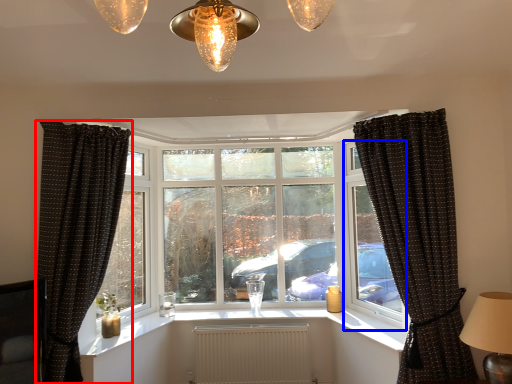
Question: Among these objects, which one is nearest to the camera, curtain (highlighted by a red box) or window frame (highlighted by a blue box)?

Choices:
 (A) curtain
 (B) window frame

Answer: (A)